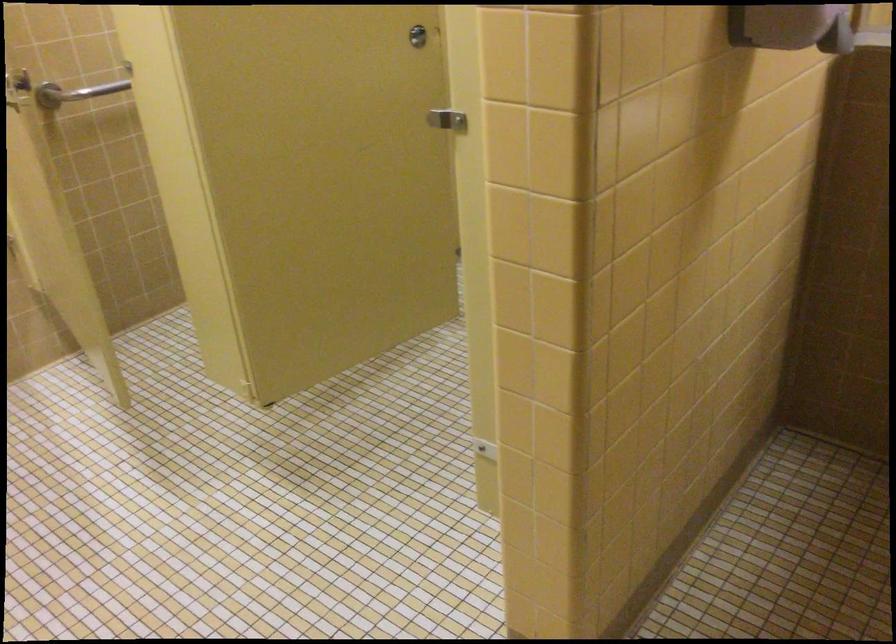
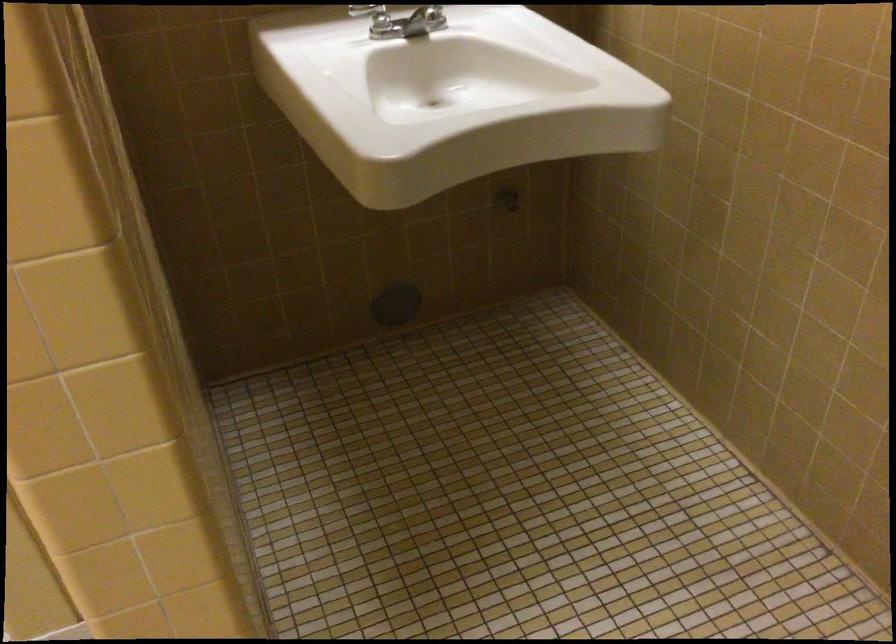
Based on the continuous images, in which direction is the camera rotating?

The camera rotated toward right-down.